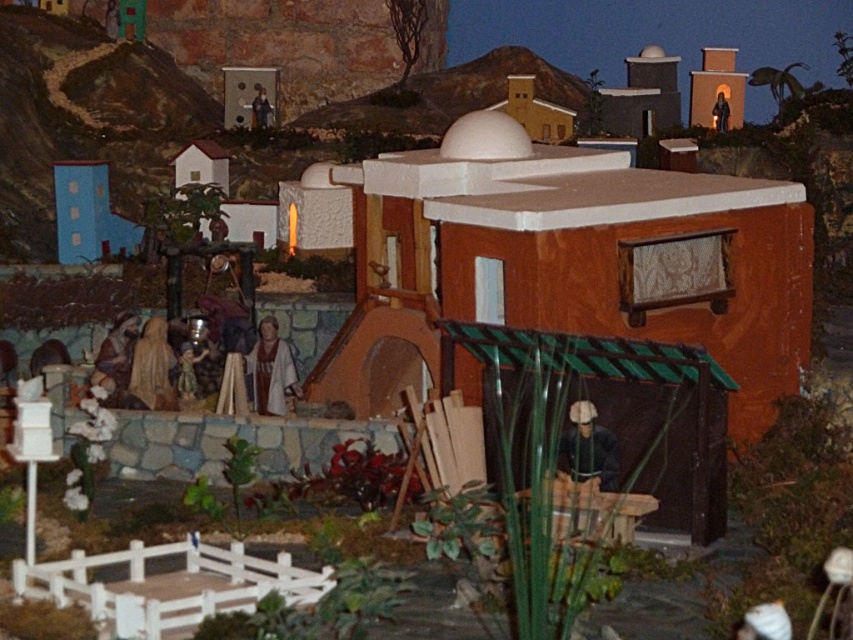
You are a visitor in this diorama scene and want to take a photo of the matte black statue at upper right without the blue fabric hut at left blocking the view. Is there a position where you can stand to achieve this?

The blue fabric hut at left is in front of the matte black statue at upper right, so you can move to the right side of the blue fabric hut at left to get a clear view of the matte black statue at upper right without obstruction.

You are a small toy car that is 0.5 meters long. You want to drive from the matte orange hut at upper center to the matte black statue at upper right. Is there enough space between them for you to pass through?

The matte orange hut at upper center is 1.82 meters away from the matte black statue at upper right, so yes, the toy car can pass through since the distance is more than its length of 0.5 meters.

You are a visitor standing in front of the diorama and want to determine which of the two points, point [120,221] or point [720,116], is closer to you. Based on the scene, can you identify which point is nearer?

Point [120,221] is closer to the viewer than point [720,116].